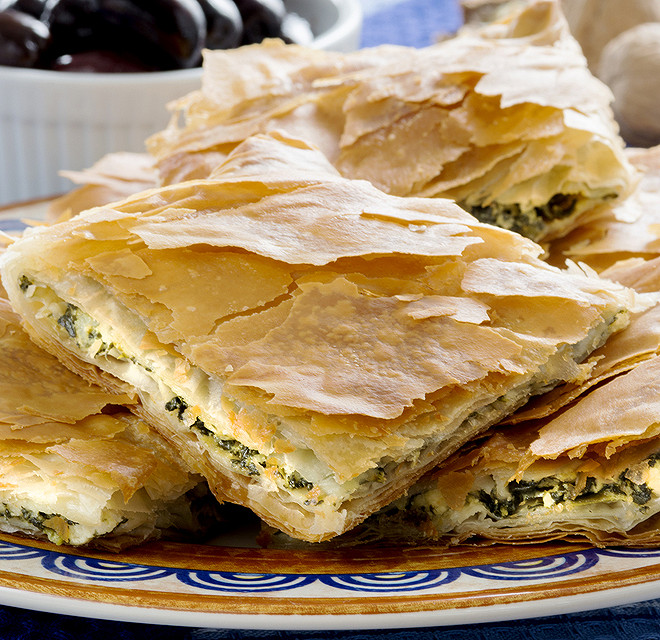
Locate an element on the screen. Image resolution: width=660 pixels, height=640 pixels. blue table cloth is located at coordinates (30, 623), (86, 630), (637, 627), (585, 626).